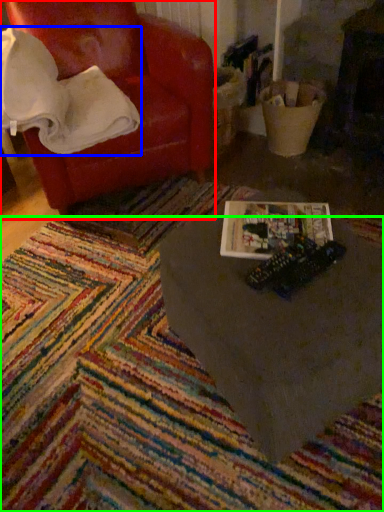
Question: Which is farther away from chair (highlighted by a red box)? blanket (highlighted by a blue box) or mat (highlighted by a green box)?

Choices:
 (A) blanket
 (B) mat

Answer: (B)